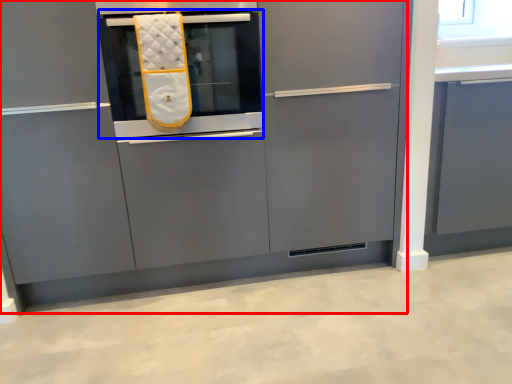
Question: Which object appears closest to the camera in this image, cabinetry (highlighted by a red box) or oven (highlighted by a blue box)?

Choices:
 (A) cabinetry
 (B) oven

Answer: (A)